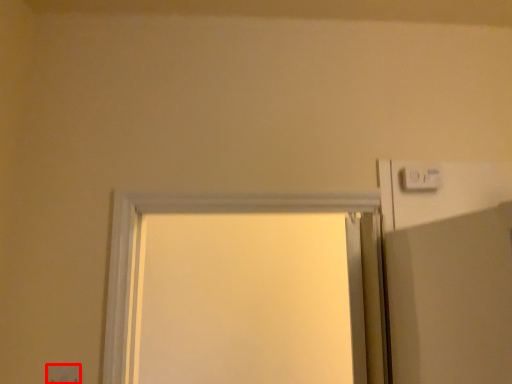
Question: In this image, where is electric outlet (annotated by the red box) located relative to light switch?

Choices:
 (A) left
 (B) right

Answer: (A)